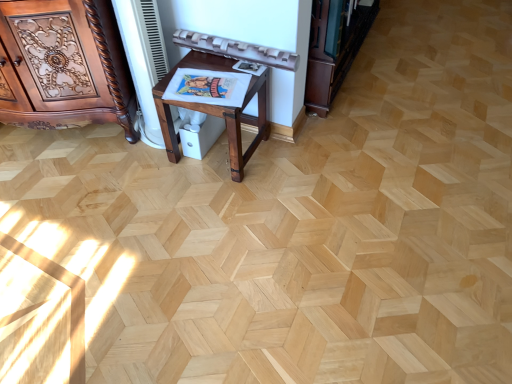
What is the approximate height of polished wood cabinet at left?

polished wood cabinet at left is 27.03 inches tall.

Find the location of `polished wood cabinet at left`. polished wood cabinet at left is located at coordinates (64, 65).

Consider the image. From the image's perspective, is polished wood cabinet at left positioned above or below mahogany wood table at center?

polished wood cabinet at left is above mahogany wood table at center.

Which is behind, point (49, 82) or point (195, 66)?

The point (49, 82) is farther.

Who is bigger, polished wood cabinet at left or mahogany wood table at center?

With larger size is polished wood cabinet at left.

From a real-world perspective, is dark brown wood bookshelf at upper right below mahogany wood table at center?

Actually, dark brown wood bookshelf at upper right is physically above mahogany wood table at center in the real world.

Between dark brown wood bookshelf at upper right and mahogany wood table at center, which one has smaller size?

Smaller between the two is mahogany wood table at center.

From the image's perspective, between dark brown wood bookshelf at upper right and mahogany wood table at center, which one is located above?

dark brown wood bookshelf at upper right, from the image's perspective.

Is point (220, 68) in front of point (313, 12)?

No, it is behind (313, 12).

Considering the sizes of objects mahogany wood table at center and dark brown wood bookshelf at upper right in the image provided, who is bigger, mahogany wood table at center or dark brown wood bookshelf at upper right?

With larger size is dark brown wood bookshelf at upper right.

From their relative heights in the image, would you say mahogany wood table at center is taller or shorter than dark brown wood bookshelf at upper right?

Considering their sizes, mahogany wood table at center has less height than dark brown wood bookshelf at upper right.

Is mahogany wood table at center oriented away from dark brown wood bookshelf at upper right?

Absolutely, mahogany wood table at center is directed away from dark brown wood bookshelf at upper right.

Is polished wood cabinet at left located within mahogany wood table at center?

That's incorrect, polished wood cabinet at left is not inside mahogany wood table at center.

Considering the points (266, 81) and (4, 25), which point is behind, point (266, 81) or point (4, 25)?

The point (266, 81) is farther from the camera.

Is the position of mahogany wood table at center more distant than that of polished wood cabinet at left?

Yes.

Is mahogany wood table at center facing towards polished wood cabinet at left?

No.

In the image, is polished wood cabinet at left positioned in front of or behind dark brown wood bookshelf at upper right?

polished wood cabinet at left is in front of dark brown wood bookshelf at upper right.

Considering the relative sizes of polished wood cabinet at left and dark brown wood bookshelf at upper right in the image provided, is polished wood cabinet at left shorter than dark brown wood bookshelf at upper right?

No.

From the image's perspective, between polished wood cabinet at left and dark brown wood bookshelf at upper right, who is located below?

polished wood cabinet at left is shown below in the image.

How many degrees apart are the facing directions of dark brown wood bookshelf at upper right and polished wood cabinet at left?

The facing directions of dark brown wood bookshelf at upper right and polished wood cabinet at left are 70.2 degrees apart.

Where is `furniture in front of the dark brown wood bookshelf at upper right`? This screenshot has width=512, height=384. furniture in front of the dark brown wood bookshelf at upper right is located at coordinates (64, 65).

From the image's perspective, which is below, dark brown wood bookshelf at upper right or polished wood cabinet at left?

From the image's view, polished wood cabinet at left is below.

Considering the relative sizes of dark brown wood bookshelf at upper right and polished wood cabinet at left in the image provided, is dark brown wood bookshelf at upper right smaller than polished wood cabinet at left?

Yes, dark brown wood bookshelf at upper right is smaller than polished wood cabinet at left.

Identify the location of furniture that appears above the mahogany wood table at center (from a real-world perspective). Image resolution: width=512 pixels, height=384 pixels. (64, 65).

This screenshot has width=512, height=384. In order to click on table on the left of dark brown wood bookshelf at upper right in this screenshot , I will do `click(217, 111)`.

From the image, which object appears to be farther from polished wood cabinet at left, mahogany wood table at center or dark brown wood bookshelf at upper right?

Among the two, dark brown wood bookshelf at upper right is located further to polished wood cabinet at left.

Looking at the image, which one is located further to mahogany wood table at center, polished wood cabinet at left or dark brown wood bookshelf at upper right?

Based on the image, dark brown wood bookshelf at upper right appears to be further to mahogany wood table at center.

Estimate the real-world distances between objects in this image. Which object is further from polished wood cabinet at left, dark brown wood bookshelf at upper right or mahogany wood table at center?

dark brown wood bookshelf at upper right.

From the image, which object appears to be nearer to dark brown wood bookshelf at upper right, polished wood cabinet at left or mahogany wood table at center?

mahogany wood table at center.

Looking at the image, which one is located closer to mahogany wood table at center, dark brown wood bookshelf at upper right or polished wood cabinet at left?

polished wood cabinet at left is closer to mahogany wood table at center.

Based on their spatial positions, is mahogany wood table at center or polished wood cabinet at left further from dark brown wood bookshelf at upper right?

polished wood cabinet at left is positioned further to the anchor dark brown wood bookshelf at upper right.

Where is `table located between polished wood cabinet at left and dark brown wood bookshelf at upper right in the left-right direction`? The height and width of the screenshot is (384, 512). table located between polished wood cabinet at left and dark brown wood bookshelf at upper right in the left-right direction is located at coordinates (217, 111).